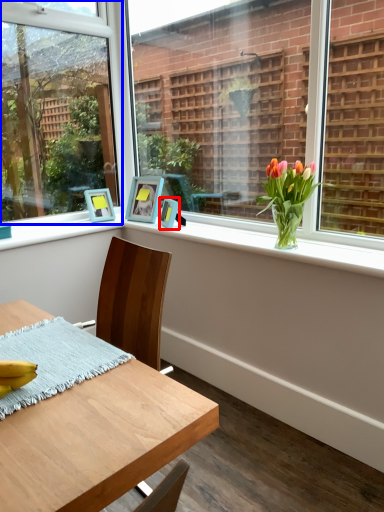
Question: Which object is closer to the camera taking this photo, picture frame (highlighted by a red box) or window (highlighted by a blue box)?

Choices:
 (A) picture frame
 (B) window

Answer: (B)